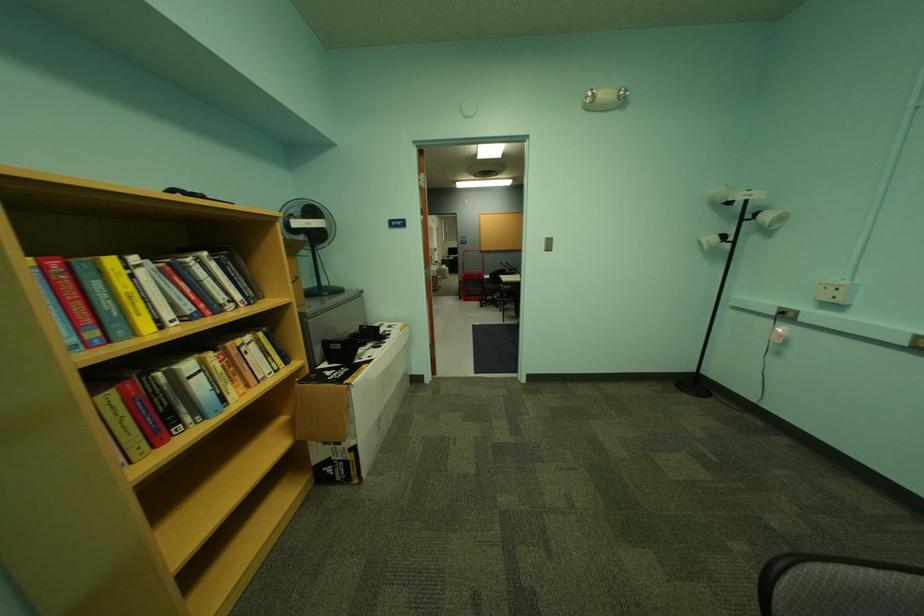
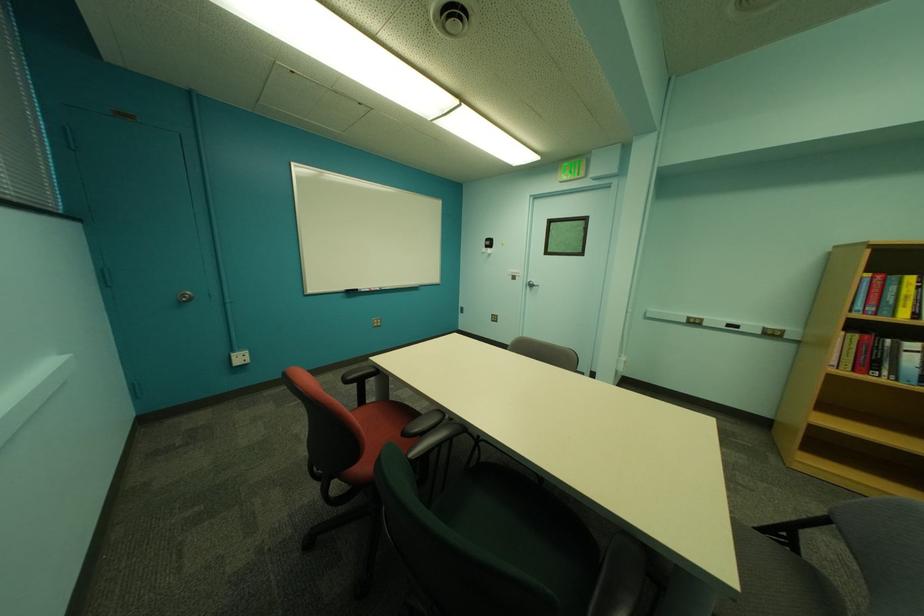
The point at (103, 334) is marked in the first image. Where is the corresponding point in the second image?

(881, 310)